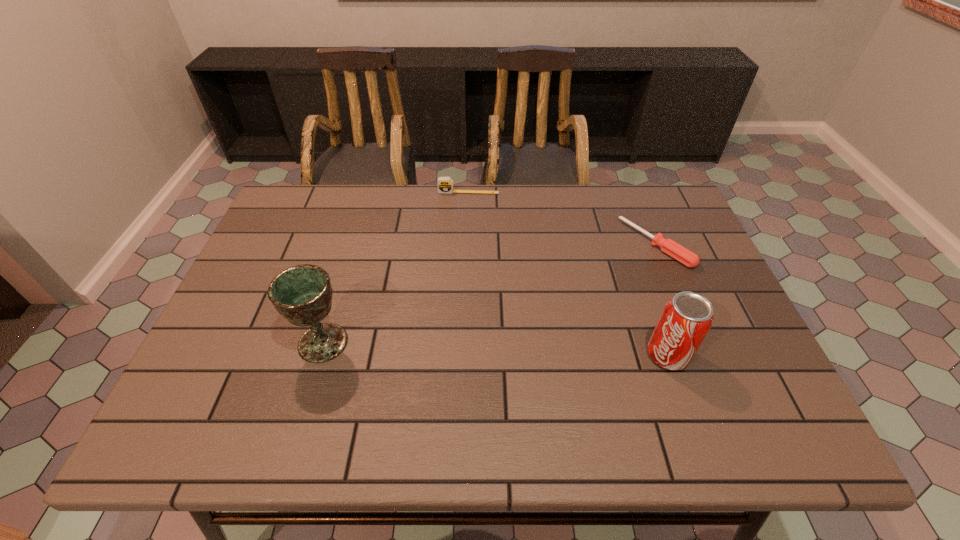
At what (x,y) coordinates should I click in order to perform the action: click on free space on the desktop that is between the leftmost object and the soda can and is positioned at the tip of the shortest object. Please return your answer as a coordinate pair (x, y). The height and width of the screenshot is (540, 960). Looking at the image, I should click on (503, 349).

Identify the location of free space on the desktop that is between the leftmost object and the second tallest object and is positioned at the front of the third object from right to left with the tape extended. This screenshot has width=960, height=540. (452, 347).